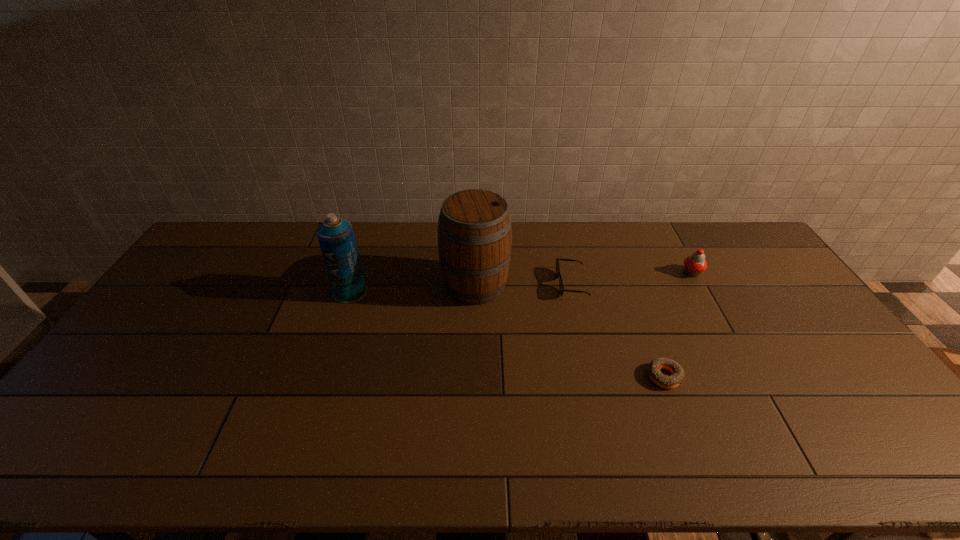
Where is `vacant space located 0.220m on the left of the rightmost object`? The height and width of the screenshot is (540, 960). vacant space located 0.220m on the left of the rightmost object is located at coordinates (617, 273).

You are a GUI agent. You are given a task and a screenshot of the screen. Output one action in this format:
    pyautogui.click(x=<x>, y=<y>)
    Task: Click on the vacant region located on the front-facing side of the second shortest object
    Image resolution: width=960 pixels, height=540 pixels.
    Given the screenshot: What is the action you would take?
    pyautogui.click(x=476, y=284)

I want to click on vacant region located 0.120m on the front-facing side of the second shortest object, so click(522, 284).

You are a GUI agent. You are given a task and a screenshot of the screen. Output one action in this format:
    pyautogui.click(x=<x>, y=<y>)
    Task: Click on the free space located on the front-facing side of the second shortest object
    
    Given the screenshot: What is the action you would take?
    point(489,284)

What are the coordinates of `vacant position located on the right of the doughnut` in the screenshot? It's located at (730, 376).

In the image, there is a desktop. Where is `free space at the far edge`? free space at the far edge is located at coordinates (371, 242).

Identify the location of free spot at the near edge of the desktop. (544, 472).

Identify the location of vacant space at the left edge of the desktop. The width and height of the screenshot is (960, 540). (178, 342).

This screenshot has width=960, height=540. Find the location of `vacant space at the right edge`. vacant space at the right edge is located at coordinates 795,310.

You are a GUI agent. You are given a task and a screenshot of the screen. Output one action in this format:
    pyautogui.click(x=<x>, y=<y>)
    Task: Click on the free space between the nearest object and the leftmost object
    
    Given the screenshot: What is the action you would take?
    pyautogui.click(x=507, y=334)